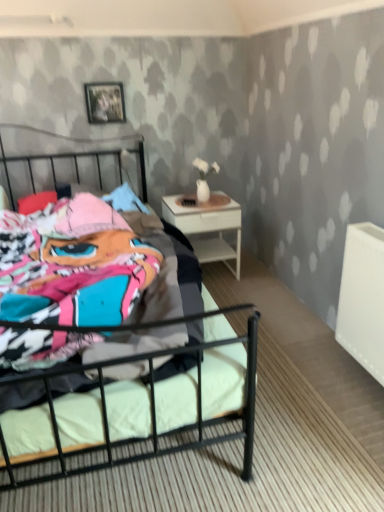
Question: Does metallic silver picture frame at upper center appear on the right side of white glossy nightstand at right?

Choices:
 (A) yes
 (B) no

Answer: (B)

Question: Is metallic silver picture frame at upper center thinner than white glossy nightstand at right?

Choices:
 (A) yes
 (B) no

Answer: (A)

Question: Is the surface of metallic silver picture frame at upper center in direct contact with white glossy nightstand at right?

Choices:
 (A) yes
 (B) no

Answer: (B)

Question: Can white glossy nightstand at right be found inside metallic silver picture frame at upper center?

Choices:
 (A) no
 (B) yes

Answer: (A)

Question: Considering the relative sizes of metallic silver picture frame at upper center and white glossy nightstand at right in the image provided, is metallic silver picture frame at upper center shorter than white glossy nightstand at right?

Choices:
 (A) yes
 (B) no

Answer: (A)

Question: Does metallic silver picture frame at upper center have a smaller size compared to white glossy nightstand at right?

Choices:
 (A) no
 (B) yes

Answer: (B)

Question: Is white glossy nightstand at right located within metallic black bed at center?

Choices:
 (A) no
 (B) yes

Answer: (A)

Question: Does metallic black bed at center have a lesser height compared to white glossy nightstand at right?

Choices:
 (A) yes
 (B) no

Answer: (B)

Question: Is metallic black bed at center outside of white glossy nightstand at right?

Choices:
 (A) no
 (B) yes

Answer: (B)

Question: Is metallic black bed at center thinner than white glossy nightstand at right?

Choices:
 (A) no
 (B) yes

Answer: (A)

Question: Is the position of metallic black bed at center less distant than that of white glossy nightstand at right?

Choices:
 (A) no
 (B) yes

Answer: (B)

Question: Does metallic black bed at center turn towards white glossy nightstand at right?

Choices:
 (A) yes
 (B) no

Answer: (B)

Question: Is white glossy nightstand at right not within metallic black bed at center?

Choices:
 (A) no
 (B) yes

Answer: (B)